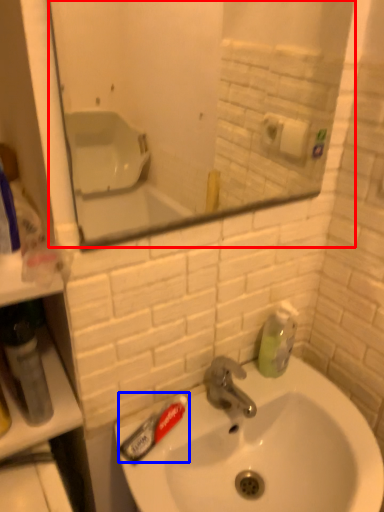
Question: Which of the following is the farthest to the observer, mirror (highlighted by a red box) or toothpaste (highlighted by a blue box)?

Choices:
 (A) mirror
 (B) toothpaste

Answer: (B)